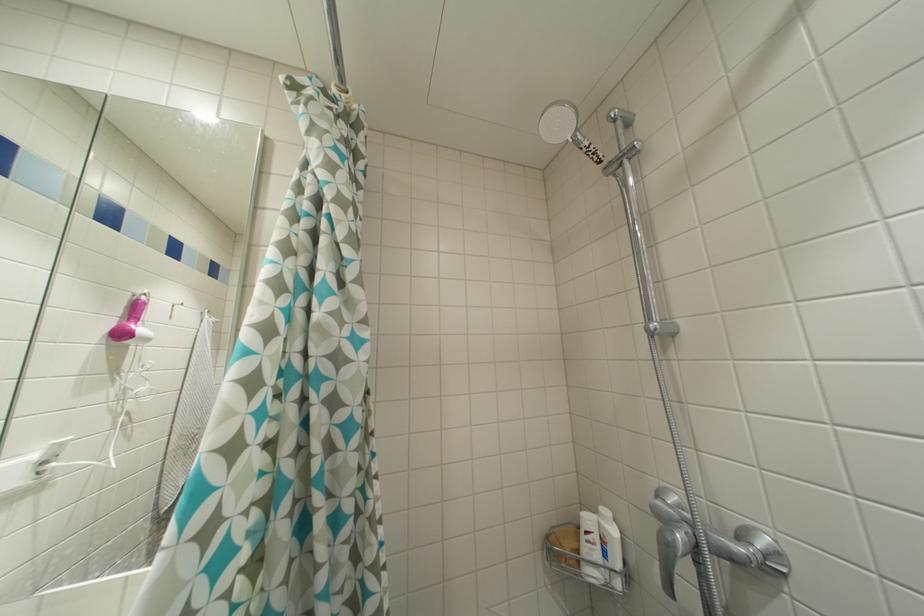
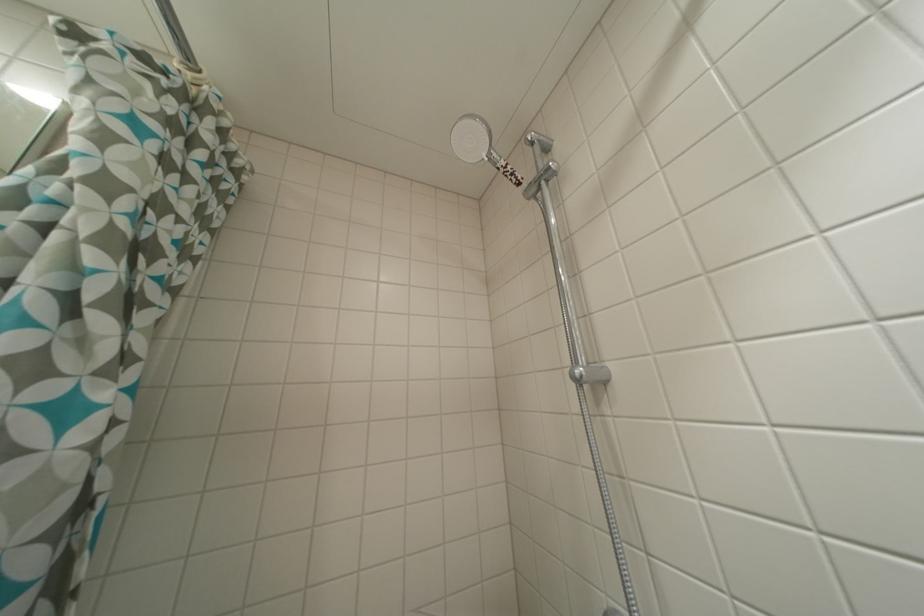
Which direction would the cameraman need to move to produce the second image?

The movement direction of the cameraman is right, forward.